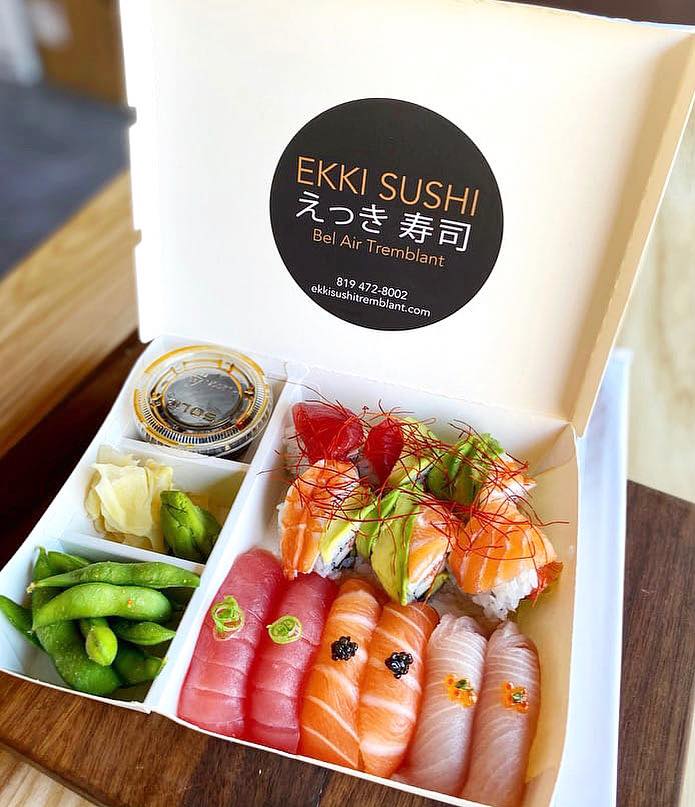
Locate an element on the screen. The width and height of the screenshot is (695, 807). table is located at coordinates (67, 320).